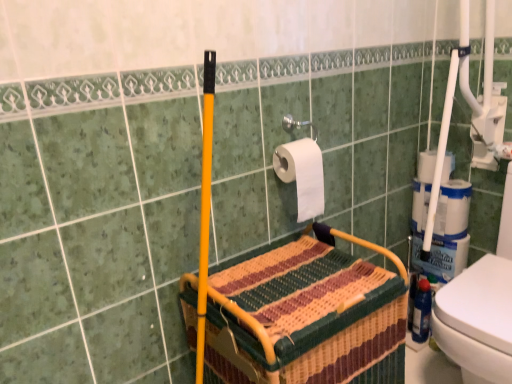
What do you see at coordinates (421, 313) in the screenshot?
I see `blue plastic bottle at lower right` at bounding box center [421, 313].

The image size is (512, 384). Describe the element at coordinates (426, 166) in the screenshot. I see `white matte toilet paper at right, the first toilet paper positioned from the back` at that location.

I want to click on woven fabric basket at center, so click(306, 315).

From a real-world perspective, between white matte toilet paper at upper center, the 1th toilet paper from the front, and blue plastic bottle at lower right, who is vertically lower?

blue plastic bottle at lower right, from a real-world perspective.

I want to click on the 2nd toilet paper located above the blue plastic bottle at lower right (from a real-world perspective), so click(x=302, y=175).

Is point (301, 219) positioned behind point (428, 316)?

No, (301, 219) is in front of (428, 316).

Which is more to the left, white matte toilet paper at right, which ranks as the 2th toilet paper in left-to-right order, or white matte toilet paper at upper center, which is the 2th toilet paper from right to left?

white matte toilet paper at upper center, which is the 2th toilet paper from right to left.

From a real-world perspective, is white matte toilet paper at right, which ranks as the 2th toilet paper in left-to-right order, located beneath white matte toilet paper at upper center, the 1th toilet paper from the front?

Yes, from a real-world perspective, white matte toilet paper at right, which ranks as the 2th toilet paper in left-to-right order, is below white matte toilet paper at upper center, the 1th toilet paper from the front.

Considering the relative positions of white matte toilet paper at right, the 2th toilet paper positioned from the front, and white matte toilet paper at upper center, marked as the 1th toilet paper in a left-to-right arrangement, in the image provided, is white matte toilet paper at right, the 2th toilet paper positioned from the front, in front of white matte toilet paper at upper center, marked as the 1th toilet paper in a left-to-right arrangement,?

No, it is not.

Consider the image. From a real-world perspective, is woven fabric basket at center located higher than white matte toilet paper at right, which ranks as the 2th toilet paper in left-to-right order?

Actually, woven fabric basket at center is physically below white matte toilet paper at right, which ranks as the 2th toilet paper in left-to-right order, in the real world.

In order to click on crate that appears in front of the white matte toilet paper at right, which is counted as the first toilet paper, starting from the right in this screenshot , I will do `click(306, 315)`.

Which object is closer to the camera taking this photo, woven fabric basket at center or white matte toilet paper at right, which is counted as the first toilet paper, starting from the right?

Positioned in front is woven fabric basket at center.

Does point (240, 315) come in front of point (315, 191)?

Yes.

Can we say woven fabric basket at center lies outside white matte toilet paper at upper center, the 2th toilet paper viewed from the back?

Yes, woven fabric basket at center is outside of white matte toilet paper at upper center, the 2th toilet paper viewed from the back.

Can you confirm if woven fabric basket at center is shorter than white matte toilet paper at upper center, the 1th toilet paper from the front?

No.

How different are the orientations of woven fabric basket at center and white matte toilet paper at upper center, which is the 2th toilet paper from right to left, in degrees?

They differ by 0.256 degrees in their facing directions.

Who is taller, white matte toilet paper at upper center, the 1th toilet paper from the front, or woven fabric basket at center?

woven fabric basket at center is taller.

Could you tell me if white matte toilet paper at upper center, marked as the 1th toilet paper in a left-to-right arrangement, is turned towards woven fabric basket at center?

No, white matte toilet paper at upper center, marked as the 1th toilet paper in a left-to-right arrangement, is not facing towards woven fabric basket at center.

Which of these two, white matte toilet paper at upper center, which is the 2th toilet paper from right to left, or woven fabric basket at center, is smaller?

Smaller between the two is white matte toilet paper at upper center, which is the 2th toilet paper from right to left.

Considering the positions of objects white matte toilet paper at upper center, the 1th toilet paper from the front, and woven fabric basket at center in the image provided, who is more to the right, white matte toilet paper at upper center, the 1th toilet paper from the front, or woven fabric basket at center?

woven fabric basket at center is more to the right.

From the image's perspective, which one is positioned lower, white matte toilet paper at right, which is counted as the first toilet paper, starting from the right, or woven fabric basket at center?

woven fabric basket at center appears lower in the image.

In the scene shown: Is white matte toilet paper at right, the first toilet paper positioned from the back, facing away from woven fabric basket at center?

white matte toilet paper at right, the first toilet paper positioned from the back, is not turned away from woven fabric basket at center.

From a real-world perspective, is white matte toilet paper at right, the first toilet paper positioned from the back, positioned under woven fabric basket at center based on gravity?

Incorrect, from a real-world perspective, white matte toilet paper at right, the first toilet paper positioned from the back, is higher than woven fabric basket at center.

Between point (424, 303) and point (319, 195), which one is positioned in front?

The point (319, 195) is closer.

Is blue plastic bottle at lower right taller or shorter than white matte toilet paper at upper center, the 1th toilet paper from the front?

Considering their sizes, blue plastic bottle at lower right has more height than white matte toilet paper at upper center, the 1th toilet paper from the front.

From a real-world perspective, is blue plastic bottle at lower right positioned over white matte toilet paper at upper center, marked as the 1th toilet paper in a left-to-right arrangement, based on gravity?

Incorrect, from a real-world perspective, blue plastic bottle at lower right is lower than white matte toilet paper at upper center, marked as the 1th toilet paper in a left-to-right arrangement.

From the image's perspective, is blue plastic bottle at lower right above or below white matte toilet paper at upper center, the 1th toilet paper from the front?

Clearly, from the image's perspective, blue plastic bottle at lower right is below white matte toilet paper at upper center, the 1th toilet paper from the front.

This screenshot has width=512, height=384. Identify the location of the 1st toilet paper above the blue plastic bottle at lower right (from the image's perspective). (302, 175).

Locate an element on the screen. The height and width of the screenshot is (384, 512). toilet paper below the white matte toilet paper at right, which ranks as the 2th toilet paper in left-to-right order (from the image's perspective) is located at coordinates (302, 175).

Which object lies nearer to the anchor point blue plastic bottle at lower right, white matte toilet paper at upper center, which is the 2th toilet paper from right to left, or woven fabric basket at center?

woven fabric basket at center is closer to blue plastic bottle at lower right.

Looking at the image, which one is located closer to woven fabric basket at center, white matte toilet paper at upper center, marked as the 1th toilet paper in a left-to-right arrangement, or blue plastic bottle at lower right?

white matte toilet paper at upper center, marked as the 1th toilet paper in a left-to-right arrangement.

Estimate the real-world distances between objects in this image. Which object is closer to white matte toilet paper at upper center, which is the 2th toilet paper from right to left, woven fabric basket at center or white matte toilet paper at right, which is counted as the first toilet paper, starting from the right?

woven fabric basket at center.

When comparing their distances from white matte toilet paper at right, the first toilet paper positioned from the back, does white matte toilet paper at upper center, which is the 2th toilet paper from right to left, or blue plastic bottle at lower right seem further?

The object further to white matte toilet paper at right, the first toilet paper positioned from the back, is blue plastic bottle at lower right.

When comparing their distances from blue plastic bottle at lower right, does white matte toilet paper at right, the first toilet paper positioned from the back, or woven fabric basket at center seem further?

woven fabric basket at center lies further to blue plastic bottle at lower right than the other object.

Looking at the image, which one is located closer to white matte toilet paper at right, which ranks as the 2th toilet paper in left-to-right order, blue plastic bottle at lower right or woven fabric basket at center?

blue plastic bottle at lower right is closer to white matte toilet paper at right, which ranks as the 2th toilet paper in left-to-right order.

From the image, which object appears to be nearer to white matte toilet paper at right, the first toilet paper positioned from the back, white matte toilet paper at upper center, the 2th toilet paper viewed from the back, or woven fabric basket at center?

white matte toilet paper at upper center, the 2th toilet paper viewed from the back, is closer to white matte toilet paper at right, the first toilet paper positioned from the back.

Considering their positions, is blue plastic bottle at lower right positioned closer to woven fabric basket at center than white matte toilet paper at upper center, which is the 2th toilet paper from right to left?

Based on the image, white matte toilet paper at upper center, which is the 2th toilet paper from right to left, appears to be nearer to woven fabric basket at center.

The height and width of the screenshot is (384, 512). What are the coordinates of `bottle between white matte toilet paper at upper center, which is the 2th toilet paper from right to left, and white matte toilet paper at right, the 2th toilet paper positioned from the front, in the horizontal direction` in the screenshot? It's located at click(x=421, y=313).

Where is `toilet paper between woven fabric basket at center and white matte toilet paper at right, the 2th toilet paper positioned from the front, along the z-axis`? The height and width of the screenshot is (384, 512). toilet paper between woven fabric basket at center and white matte toilet paper at right, the 2th toilet paper positioned from the front, along the z-axis is located at coordinates (302, 175).